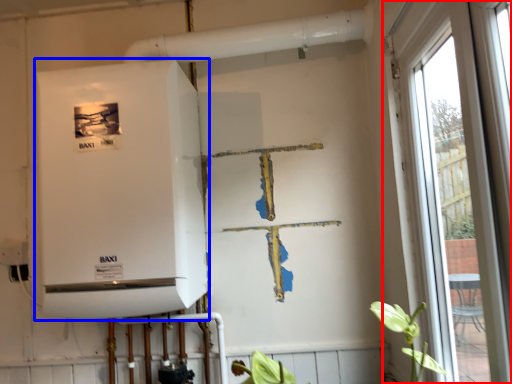
Question: Which point is further to the camera, window (highlighted by a red box) or appliance (highlighted by a blue box)?

Choices:
 (A) window
 (B) appliance

Answer: (B)